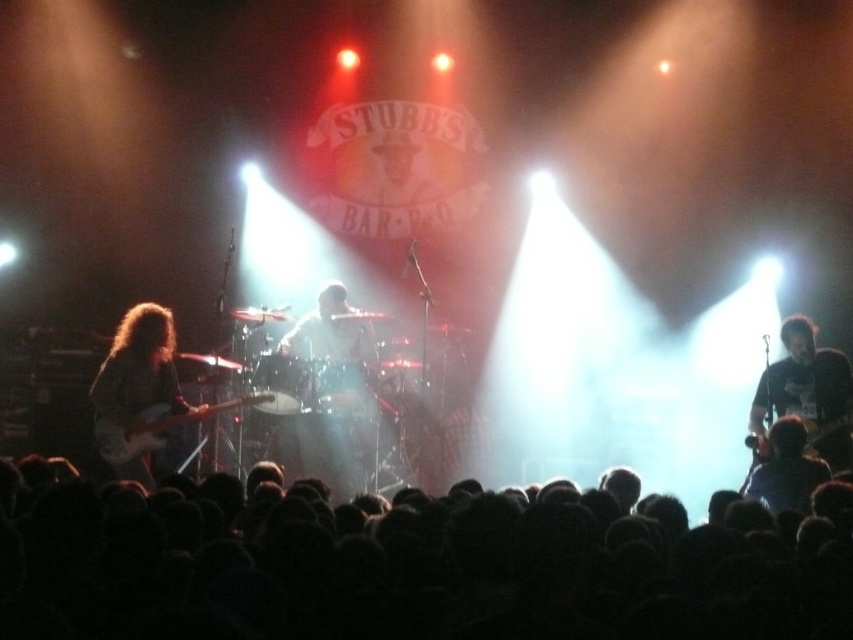
Question: Among these points, which one is nearest to the camera?

Choices:
 (A) (770, 406)
 (B) (164, 376)
 (C) (315, 356)
 (D) (0, 595)

Answer: (D)

Question: Does black matte guitar at right have a smaller size compared to dark blue shirt at lower right?

Choices:
 (A) yes
 (B) no

Answer: (B)

Question: From the image, what is the correct spatial relationship of black hair at lower center in relation to shiny black guitar at left?

Choices:
 (A) right
 (B) left

Answer: (A)

Question: Can you confirm if white matte drum set at center is wider than matte black electric guitar at left?

Choices:
 (A) no
 (B) yes

Answer: (A)

Question: Based on their relative distances, which object is farther from the shiny black guitar at left?

Choices:
 (A) matte black electric guitar at left
 (B) dark blue shirt at lower right

Answer: (B)

Question: Estimate the real-world distances between objects in this image. Which object is closer to the dark blue shirt at lower right?

Choices:
 (A) black matte guitar at right
 (B) shiny black guitar at left
 (C) matte black electric guitar at left
 (D) black hair at lower center

Answer: (A)